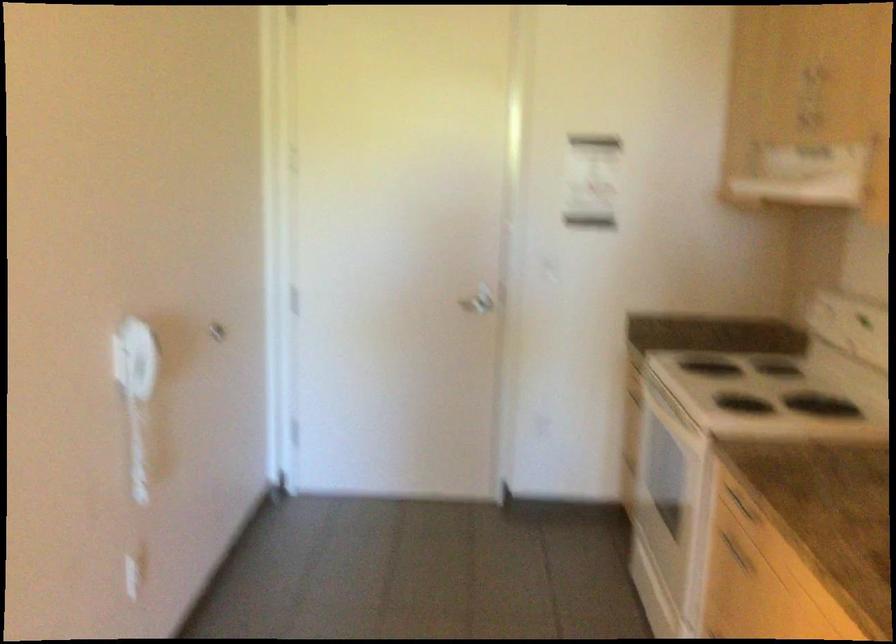
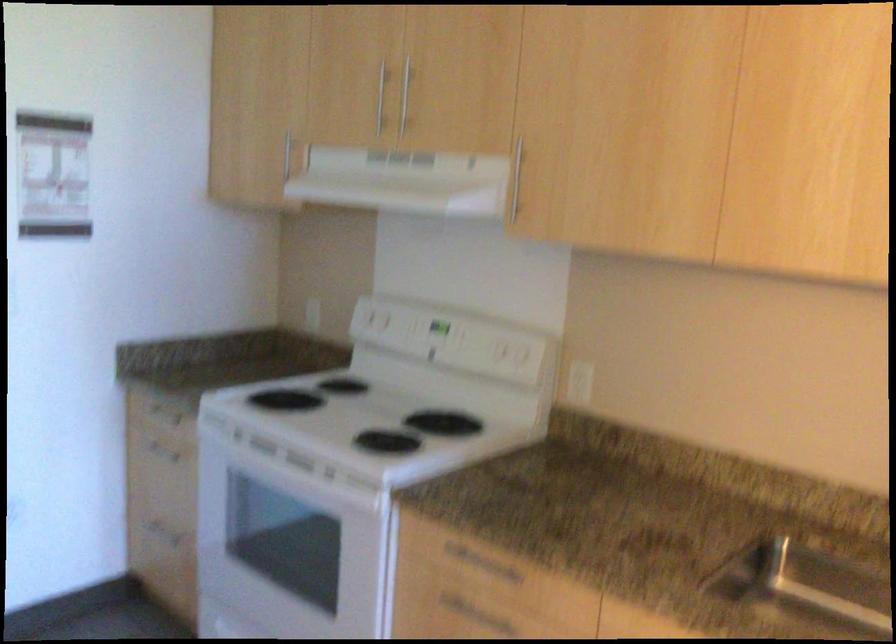
Locate, in the second image, the point that corresponds to point 702,504 in the first image.

(385, 571)